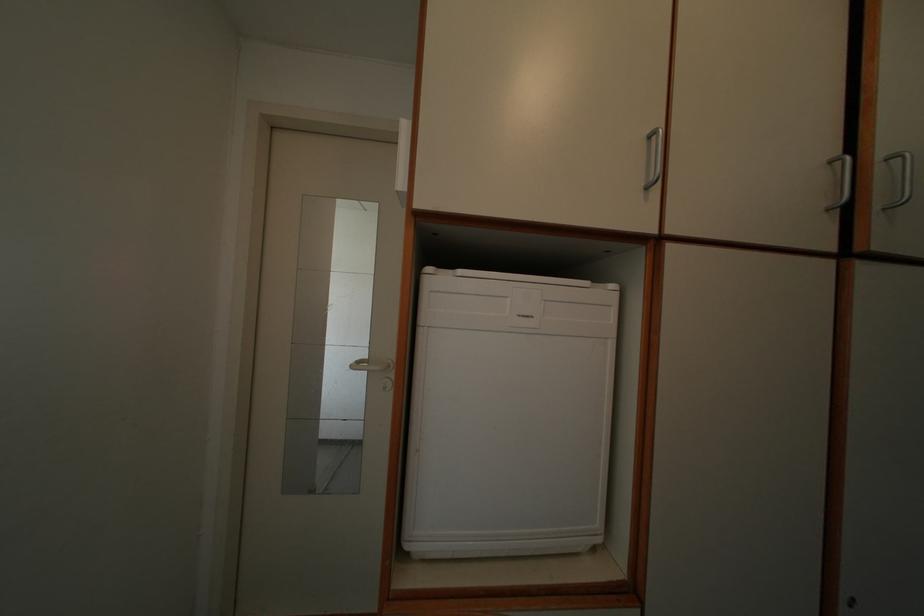
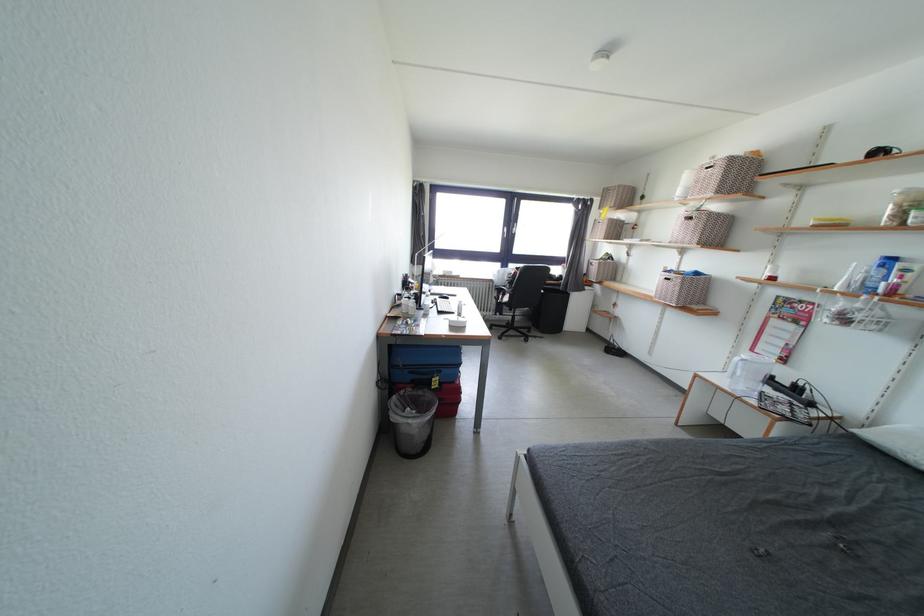
Question: The images are taken continuously from a first-person perspective. In which direction is your viewpoint rotating?

Choices:
 (A) Left
 (B) Right
 (C) Up
 (D) Down

Answer: (A)